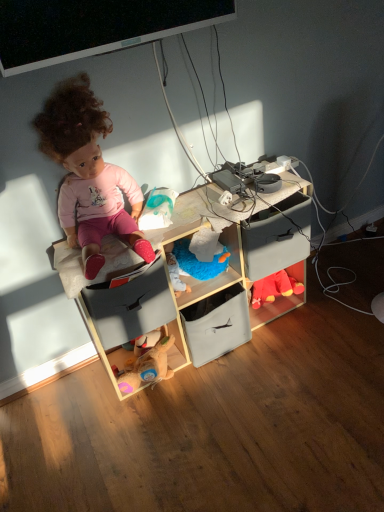
Where is `matte pink doll at upper left`? This screenshot has height=512, width=384. matte pink doll at upper left is located at coordinates (88, 174).

What is the approximate width of black glossy monitor at upper center?

11.77 centimeters.

Find the location of a particular element. matte plastic bag at center, marked as the 2th toy in a back-to-front arrangement is located at coordinates (157, 209).

The image size is (384, 512). Describe the element at coordinates (216, 308) in the screenshot. I see `soft fabric storage at center, marked as the first shelf in a right-to-left arrangement` at that location.

How much space does matte gray drawer at center, which appears as the 2th drawer when viewed from the left, occupy horizontally?

matte gray drawer at center, which appears as the 2th drawer when viewed from the left, is 11.72 inches in width.

Find the location of a particular element. matte pink doll at upper left is located at coordinates (88, 174).

Considering the relative sizes of black glossy monitor at upper center and velvet red plush toy at lower right, the second toy viewed from the front, in the image provided, is black glossy monitor at upper center taller than velvet red plush toy at lower right, the second toy viewed from the front,?

Yes.

Based on the photo, from a real-world perspective, which object stands above the other?

In real-world perspective, black glossy monitor at upper center is above.

Which is correct: black glossy monitor at upper center is inside velvet red plush toy at lower right, which appears as the 2th toy when viewed from the top, or outside of it?

black glossy monitor at upper center is not enclosed by velvet red plush toy at lower right, which appears as the 2th toy when viewed from the top.

Can you confirm if soft fabric storage at center, marked as the first shelf in a right-to-left arrangement, is positioned to the right of wooden cube at center, arranged as the 1th shelf when viewed from the left?

Yes, soft fabric storage at center, marked as the first shelf in a right-to-left arrangement, is to the right of wooden cube at center, arranged as the 1th shelf when viewed from the left.

From the image's perspective, is soft fabric storage at center, marked as the first shelf in a right-to-left arrangement, on top of wooden cube at center, arranged as the 1th shelf when viewed from the left?

No, from the image's perspective, soft fabric storage at center, marked as the first shelf in a right-to-left arrangement, is not above wooden cube at center, arranged as the 1th shelf when viewed from the left.

From a real-world perspective, who is located higher, soft fabric storage at center, marked as the first shelf in a right-to-left arrangement, or wooden cube at center, arranged as the 1th shelf when viewed from the left?

wooden cube at center, arranged as the 1th shelf when viewed from the left.

Considering the sizes of objects soft fabric storage at center, marked as the first shelf in a right-to-left arrangement, and wooden cube at center, arranged as the 1th shelf when viewed from the left, in the image provided, who is thinner, soft fabric storage at center, marked as the first shelf in a right-to-left arrangement, or wooden cube at center, arranged as the 1th shelf when viewed from the left,?

Thinner between the two is soft fabric storage at center, marked as the first shelf in a right-to-left arrangement.

Does velvet red plush toy at lower right, placed as the second toy when sorted from left to right, appear on the left side of matte gray drawer at center, which appears as the 2th drawer when viewed from the left?

No, velvet red plush toy at lower right, placed as the second toy when sorted from left to right, is not to the left of matte gray drawer at center, which appears as the 2th drawer when viewed from the left.

Locate an element on the screen. toy on the right of matte gray drawer at center, which is the 1th drawer in right-to-left order is located at coordinates (274, 288).

Can you confirm if velvet red plush toy at lower right, the second toy viewed from the front, is shorter than matte gray drawer at center, which appears as the 2th drawer when viewed from the left?

Yes, velvet red plush toy at lower right, the second toy viewed from the front, is shorter than matte gray drawer at center, which appears as the 2th drawer when viewed from the left.

Which object is closer to the camera, matte plastic bag at center, the second toy in the bottom-to-top sequence, or soft fabric storage at center, positioned as the second shelf in left-to-right order?

Positioned in front is matte plastic bag at center, the second toy in the bottom-to-top sequence.

From a real-world perspective, between matte plastic bag at center, the second toy in the bottom-to-top sequence, and soft fabric storage at center, marked as the first shelf in a right-to-left arrangement, who is vertically higher?

matte plastic bag at center, the second toy in the bottom-to-top sequence, from a real-world perspective.

In terms of width, does matte plastic bag at center, which is the 1th toy from top to bottom, look wider or thinner when compared to soft fabric storage at center, marked as the first shelf in a right-to-left arrangement?

In the image, matte plastic bag at center, which is the 1th toy from top to bottom, appears to be more narrow than soft fabric storage at center, marked as the first shelf in a right-to-left arrangement.

Does soft fabric storage at center, positioned as the second shelf in left-to-right order, appear on the left side of matte gray drawer at center, which appears as the 2th drawer when viewed from the left?

Yes, soft fabric storage at center, positioned as the second shelf in left-to-right order, is to the left of matte gray drawer at center, which appears as the 2th drawer when viewed from the left.

Who is taller, soft fabric storage at center, positioned as the second shelf in left-to-right order, or matte gray drawer at center, which appears as the 2th drawer when viewed from the left?

Standing taller between the two is matte gray drawer at center, which appears as the 2th drawer when viewed from the left.

Based on the photo, how much distance is there between soft fabric storage at center, positioned as the second shelf in left-to-right order, and matte gray drawer at center, which appears as the 2th drawer when viewed from the left?

soft fabric storage at center, positioned as the second shelf in left-to-right order, and matte gray drawer at center, which appears as the 2th drawer when viewed from the left, are 7.16 inches apart from each other.

Would you consider soft fabric storage at center, positioned as the second shelf in left-to-right order, to be distant from matte gray drawer at center, which is the 1th drawer in right-to-left order?

No, soft fabric storage at center, positioned as the second shelf in left-to-right order, is in close proximity to matte gray drawer at center, which is the 1th drawer in right-to-left order.

Is matte plastic drawer at center, which is the 1th drawer from left to right, a part of soft fabric storage at center, marked as the first shelf in a right-to-left arrangement?

No, matte plastic drawer at center, which is the 1th drawer from left to right, is located outside of soft fabric storage at center, marked as the first shelf in a right-to-left arrangement.

Looking at their sizes, would you say soft fabric storage at center, marked as the first shelf in a right-to-left arrangement, is wider or thinner than matte plastic drawer at center, the 2th drawer when ordered from right to left?

Considering their sizes, soft fabric storage at center, marked as the first shelf in a right-to-left arrangement, looks slimmer than matte plastic drawer at center, the 2th drawer when ordered from right to left.

From a real-world perspective, is soft fabric storage at center, marked as the first shelf in a right-to-left arrangement, below matte plastic drawer at center, which is the 1th drawer from left to right?

Yes, from a real-world perspective, soft fabric storage at center, marked as the first shelf in a right-to-left arrangement, is beneath matte plastic drawer at center, which is the 1th drawer from left to right.

From the image's perspective, which shelf is the 2nd one below the matte plastic drawer at center, which is the 1th drawer from left to right? Please provide its 2D coordinates.

[(216, 308)]

Is point (260, 271) closer or farther from the camera than point (58, 26)?

Point (260, 271) appears to be farther away from the viewer than point (58, 26).

Is black glossy monitor at upper center surrounded by matte gray drawer at center, which is the 1th drawer in right-to-left order?

Definitely not — black glossy monitor at upper center is not inside matte gray drawer at center, which is the 1th drawer in right-to-left order.

Is matte gray drawer at center, which is the 1th drawer in right-to-left order, next to black glossy monitor at upper center?

matte gray drawer at center, which is the 1th drawer in right-to-left order, is not next to black glossy monitor at upper center, and they're not touching.

From a real-world perspective, is matte gray drawer at center, which is the 1th drawer in right-to-left order, on black glossy monitor at upper center?

No.

Image resolution: width=384 pixels, height=512 pixels. Find the location of `computer monitor lying in front of the velvet red plush toy at lower right, the second toy viewed from the front`. computer monitor lying in front of the velvet red plush toy at lower right, the second toy viewed from the front is located at coordinates (94, 27).

Find the location of a particular element. shelf above the soft fabric storage at center, marked as the first shelf in a right-to-left arrangement (from the image's perspective) is located at coordinates (202, 281).

Considering their positions, is wooden cube at center, the second shelf from the right, positioned closer to matte plastic bag at center, the second toy in the bottom-to-top sequence, than matte plastic drawer at center, which is the 1th drawer from left to right?

matte plastic drawer at center, which is the 1th drawer from left to right, lies closer to matte plastic bag at center, the second toy in the bottom-to-top sequence, than the other object.

When comparing their distances from soft fabric storage at center, marked as the first shelf in a right-to-left arrangement, does wooden cube at center, arranged as the 1th shelf when viewed from the left, or black glossy monitor at upper center seem closer?

Based on the image, wooden cube at center, arranged as the 1th shelf when viewed from the left, appears to be nearer to soft fabric storage at center, marked as the first shelf in a right-to-left arrangement.

Which object lies further to the anchor point matte plastic bag at center, the first toy in the left-to-right sequence, matte gray drawer at center, which is the 1th drawer in right-to-left order, or matte pink doll at upper left?

Based on the image, matte gray drawer at center, which is the 1th drawer in right-to-left order, appears to be further to matte plastic bag at center, the first toy in the left-to-right sequence.

Which object lies further to the anchor point black glossy monitor at upper center, wooden cube at center, arranged as the 1th shelf when viewed from the left, or matte plastic drawer at center, which is the 1th drawer from left to right?

matte plastic drawer at center, which is the 1th drawer from left to right, lies further to black glossy monitor at upper center than the other object.

Estimate the real-world distances between objects in this image. Which object is further from matte plastic drawer at center, the 2th drawer when ordered from right to left, matte pink doll at upper left or matte gray drawer at center, which is the 1th drawer in right-to-left order?

Among the two, matte gray drawer at center, which is the 1th drawer in right-to-left order, is located further to matte plastic drawer at center, the 2th drawer when ordered from right to left.

Based on their spatial positions, is matte plastic bag at center, placed as the 1th toy when sorted from front to back, or black glossy monitor at upper center closer to matte plastic drawer at center, which is the 1th drawer from left to right?

matte plastic bag at center, placed as the 1th toy when sorted from front to back, lies closer to matte plastic drawer at center, which is the 1th drawer from left to right, than the other object.

From the image, which object appears to be farther from matte gray drawer at center, which appears as the 2th drawer when viewed from the left, matte pink doll at upper left or matte plastic bag at center, the 2th toy viewed from the right?

The object further to matte gray drawer at center, which appears as the 2th drawer when viewed from the left, is matte pink doll at upper left.

Looking at this image, estimate the real-world distances between objects in this image. Which object is further from black glossy monitor at upper center, wooden cube at center, arranged as the 1th shelf when viewed from the left, or soft fabric storage at center, marked as the first shelf in a right-to-left arrangement?

Based on the image, soft fabric storage at center, marked as the first shelf in a right-to-left arrangement, appears to be further to black glossy monitor at upper center.

This screenshot has height=512, width=384. I want to click on shelf between black glossy monitor at upper center and soft fabric storage at center, marked as the first shelf in a right-to-left arrangement, vertically, so click(x=202, y=281).

In order to click on toy between black glossy monitor at upper center and wooden cube at center, arranged as the 1th shelf when viewed from the left, in the up-down direction in this screenshot , I will do `click(157, 209)`.

Identify the location of drawer situated between matte plastic drawer at center, the 2th drawer when ordered from right to left, and velvet red plush toy at lower right, which is the first toy in bottom-to-top order, from left to right. (277, 237).

This screenshot has height=512, width=384. Identify the location of toy located between matte pink doll at upper left and matte gray drawer at center, which appears as the 2th drawer when viewed from the left, in the left-right direction. (157, 209).